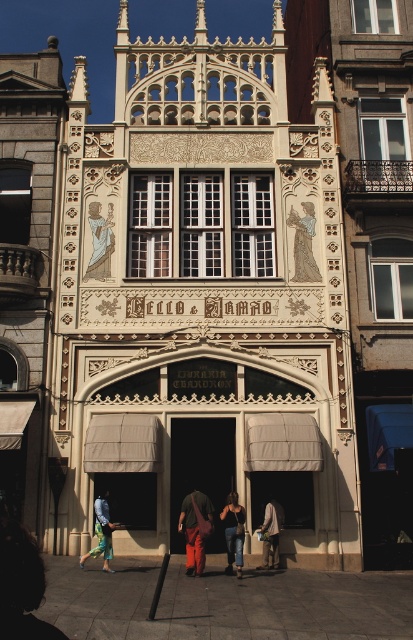
You are standing in front of the historic building and want to locate the wooden statue at upper left. According to the coordinates provided, where exactly should you look on the building?

The wooden statue at upper left is located at point coordinates of (99, 241) on the building.

You are a visitor standing in front of the historic building. You notice the wooden statue at upper left and the denim pants at lower center. Which object is positioned higher on the building?

The wooden statue at upper left is positioned higher on the building than the denim pants at lower center.

You are standing in front of the historic building and want to locate the matte gray figure at center. According to the coordinates provided, where should you look relative to the entranceway?

The matte gray figure at center is located at coordinates point (x=303, y=243), which places it near the entranceway.